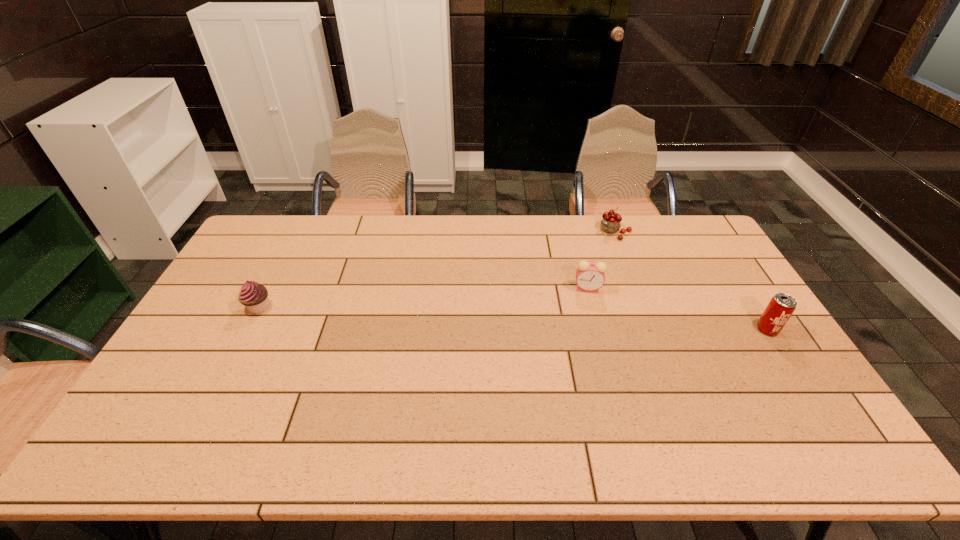
Image resolution: width=960 pixels, height=540 pixels. Find the location of `the second nearest object`. the second nearest object is located at coordinates (254, 296).

I want to click on the leftmost object, so click(254, 296).

Image resolution: width=960 pixels, height=540 pixels. I want to click on beer can, so click(x=780, y=308).

Identify the location of the nearest object. (780, 308).

This screenshot has width=960, height=540. I want to click on pot filled with cherries, so click(611, 222).

Identify the location of the farthest object. (611, 222).

This screenshot has width=960, height=540. I want to click on alarm clock, so (590, 276).

Locate an element on the screen. the second object from left to right is located at coordinates (590, 276).

Image resolution: width=960 pixels, height=540 pixels. Identify the location of vacant space located on the right of the second nearest object. (369, 307).

This screenshot has height=540, width=960. I want to click on free space located 0.060m on the front of the nearest object, so click(x=783, y=354).